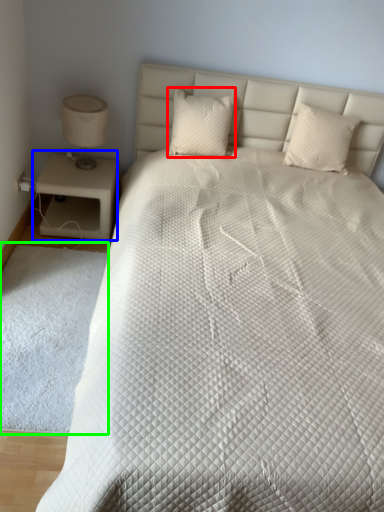
Question: Estimate the real-world distances between objects in this image. Which object is farther from pillow (highlighted by a red box), nightstand (highlighted by a blue box) or mat (highlighted by a green box)?

Choices:
 (A) nightstand
 (B) mat

Answer: (B)